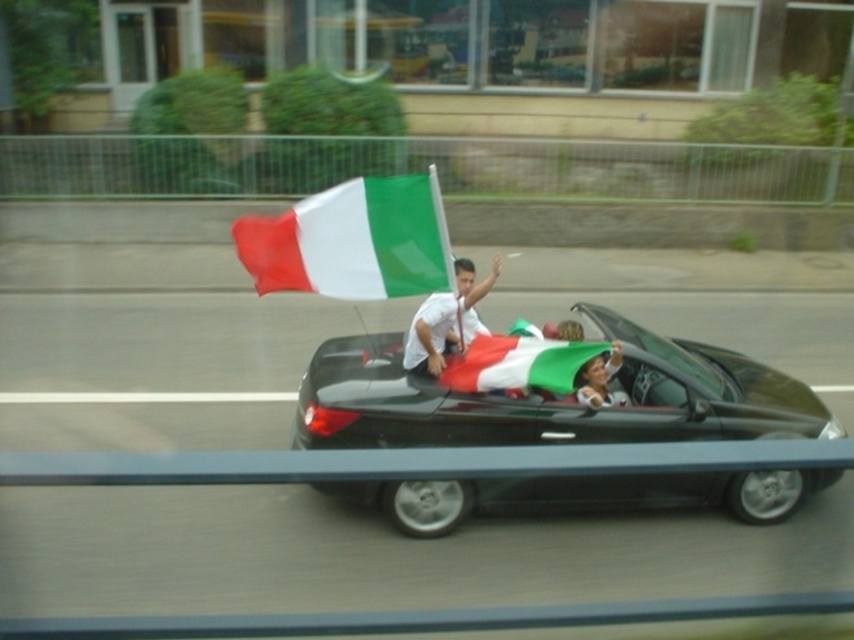
Consider the image. You are a photographer trying to capture a photo of the two points in the image. The first point is at coordinate point (402,531) and the second is at point (471,312). Which point will appear larger in your photo?

Point (402,531) is closer to the camera than point (471,312), so it will appear larger in the photo.

You are a photographer trying to capture the convertible car in the image. The car is represented by the point at point (553,400). Where should you aim your camera to ensure you capture the shiny black convertible at center?

The shiny black convertible at center is represented by point (553,400), so you should aim your camera at that point to capture it.

You are a photographer trying to capture the convertible car scene. You notice the green fabric flag at center and the matte white shirt at center. Which object should you focus on to ensure the flag is visible above the shirt in your photo?

The green fabric flag at center is located above the matte white shirt at center, so focusing on the green fabric flag at center will ensure it appears above the shirt in the photo.